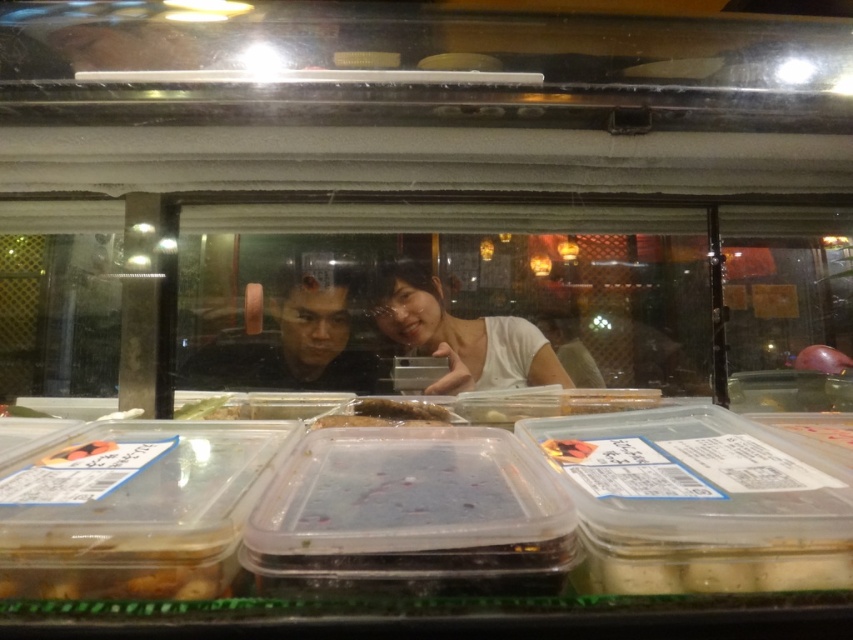
Between matte white shirt at center and translucent plastic fish at center, which one appears on the right side from the viewer's perspective?

Positioned to the right is translucent plastic fish at center.

Is point (418, 355) positioned before point (421, 406)?

No, (418, 355) is further to viewer.

Find the location of `matte white shirt at center`. matte white shirt at center is located at coordinates coord(381,339).

This screenshot has height=640, width=853. Find the location of `white matte shirt at center`. white matte shirt at center is located at coordinates (461, 336).

Does white matte shirt at center have a greater width compared to translucent plastic fish at center?

Yes, white matte shirt at center is wider than translucent plastic fish at center.

Does point (422, 275) lie behind point (397, 408)?

Yes, point (422, 275) is farther from viewer.

You are a GUI agent. You are given a task and a screenshot of the screen. Output one action in this format:
    pyautogui.click(x=<x>, y=<y>)
    Task: Click on the white matte shirt at center
    
    Given the screenshot: What is the action you would take?
    pyautogui.click(x=461, y=336)

Who is taller, white matte shirt at center or dark purple matte food at lower left?

With more height is white matte shirt at center.

Describe the element at coordinates (461, 336) in the screenshot. This screenshot has height=640, width=853. I see `white matte shirt at center` at that location.

Find the location of a particular element. The height and width of the screenshot is (640, 853). white matte shirt at center is located at coordinates (461, 336).